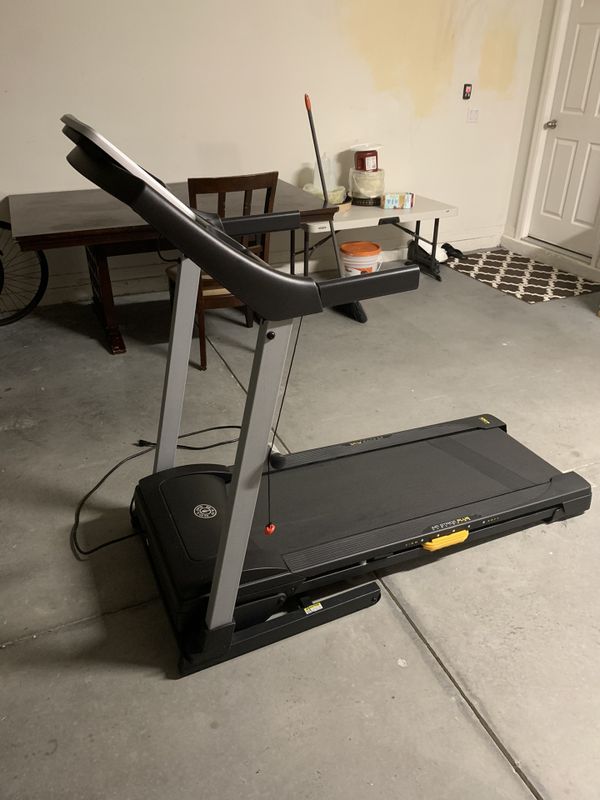
At what (x,y) coordinates should I click in order to perform the action: click on rug. Please return your answer as a coordinate pair (x, y). The image size is (600, 800). Looking at the image, I should click on (506, 278).